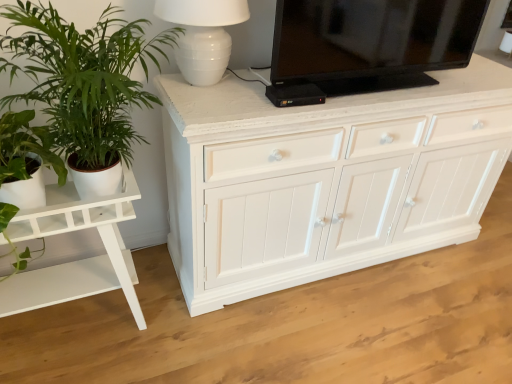
Find the location of a particular element. Image resolution: width=512 pixels, height=384 pixels. vacant area situated below white glossy table at left (from a real-world perspective) is located at coordinates (74, 329).